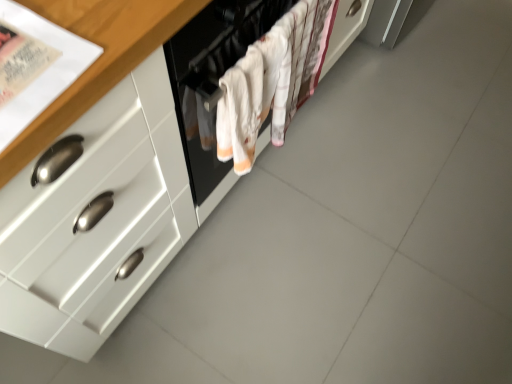
What do you see at coordinates (100, 221) in the screenshot? The height and width of the screenshot is (384, 512). I see `white glossy cabinet at center` at bounding box center [100, 221].

Looking at this image, what is the approximate height of white glossy cabinet at center?

white glossy cabinet at center is 34.22 inches in height.

What is the approximate width of white glossy cabinet at center?

The width of white glossy cabinet at center is 23.91 inches.

Locate an element on the screen. white glossy cabinet at center is located at coordinates (100, 221).

What do you see at coordinates (212, 82) in the screenshot?
I see `white fabric oven at center` at bounding box center [212, 82].

The image size is (512, 384). In order to click on white fabric oven at center in this screenshot , I will do `click(212, 82)`.

Measure the distance between point (224,43) and camera.

Point (224,43) and camera are 31.89 inches apart.

In order to face white fabric oven at center, should I rotate leftwards or rightwards?

Turn right approximately 4.288 degrees to face it.

Where is `white glossy cabinet at center`? This screenshot has width=512, height=384. white glossy cabinet at center is located at coordinates (100, 221).

In the scene shown: Is white fabric oven at center to the right of white glossy cabinet at center from the viewer's perspective?

Correct, you'll find white fabric oven at center to the right of white glossy cabinet at center.

Which object is further away from the camera taking this photo, white fabric oven at center or white glossy cabinet at center?

white fabric oven at center is behind.

Is point (224, 39) closer to viewer compared to point (198, 208)?

Yes, it is.

From the image's perspective, is white fabric oven at center above or below white glossy cabinet at center?

white fabric oven at center is situated lower than white glossy cabinet at center in the image.

From a real-world perspective, which is physically above, white fabric oven at center or white glossy cabinet at center?

In real-world perspective, white fabric oven at center is above.

Can you confirm if white fabric oven at center is thinner than white glossy cabinet at center?

Yes.

Does white fabric oven at center have a lesser height compared to white glossy cabinet at center?

Yes.

Based on their sizes in the image, would you say white fabric oven at center is bigger or smaller than white glossy cabinet at center?

white fabric oven at center is smaller than white glossy cabinet at center.

Choose the correct answer: Is white fabric oven at center inside white glossy cabinet at center or outside it?

white fabric oven at center is outside white glossy cabinet at center.

Are white fabric oven at center and white glossy cabinet at center making contact?

No, white fabric oven at center is not in contact with white glossy cabinet at center.

Is white fabric oven at center aimed at white glossy cabinet at center?

Yes, white fabric oven at center is aimed at white glossy cabinet at center.

Can you tell me how much white fabric oven at center and white glossy cabinet at center differ in facing direction?

The angle between the facing direction of white fabric oven at center and the facing direction of white glossy cabinet at center is 0.164 degrees.

Image resolution: width=512 pixels, height=384 pixels. Find the location of `cabinetry that appears below the white fabric oven at center (from a real-world perspective)`. cabinetry that appears below the white fabric oven at center (from a real-world perspective) is located at coordinates (100, 221).

Is white glossy cabinet at center at the left side of white fabric oven at center?

Yes, white glossy cabinet at center is to the left of white fabric oven at center.

Is white glossy cabinet at center in front of or behind white fabric oven at center in the image?

white glossy cabinet at center is positioned closer to the viewer than white fabric oven at center.

Which is in front, point (162, 108) or point (257, 19)?

The point (162, 108) is closer to the camera.

From the image's perspective, between white glossy cabinet at center and white fabric oven at center, which one is located above?

From the image's view, white glossy cabinet at center is above.

Consider the image. From a real-world perspective, is white glossy cabinet at center on white fabric oven at center?

No, from a real-world perspective, white glossy cabinet at center is not above white fabric oven at center.

Can you confirm if white glossy cabinet at center is wider than white fabric oven at center?

Yes, white glossy cabinet at center is wider than white fabric oven at center.

Considering the sizes of objects white glossy cabinet at center and white fabric oven at center in the image provided, who is taller, white glossy cabinet at center or white fabric oven at center?

With more height is white glossy cabinet at center.

Looking at this image, who is smaller, white glossy cabinet at center or white fabric oven at center?

Smaller between the two is white fabric oven at center.

Can we say white glossy cabinet at center lies outside white fabric oven at center?

Indeed, white glossy cabinet at center is completely outside white fabric oven at center.

Is white glossy cabinet at center directly adjacent to white fabric oven at center?

white glossy cabinet at center is not next to white fabric oven at center, and they're not touching.

Is white glossy cabinet at center facing towards white fabric oven at center?

Yes, white glossy cabinet at center is facing white fabric oven at center.

How many degrees apart are the facing directions of white glossy cabinet at center and white fabric oven at center?

The angle between the facing direction of white glossy cabinet at center and the facing direction of white fabric oven at center is 0.164 degrees.

Based on the photo, how far apart are white glossy cabinet at center and white fabric oven at center?

white glossy cabinet at center is 17.82 centimeters away from white fabric oven at center.

Where is `cabinetry that appears below the white fabric oven at center (from a real-world perspective)`? The height and width of the screenshot is (384, 512). cabinetry that appears below the white fabric oven at center (from a real-world perspective) is located at coordinates (100, 221).

There is a white glossy cabinet at center. At what (x,y) coordinates should I click in order to perform the action: click on oven above it (from a real-world perspective). Please return your answer as a coordinate pair (x, y). This screenshot has width=512, height=384. Looking at the image, I should click on (212, 82).

What are the coordinates of `cabinetry in front of the white fabric oven at center` in the screenshot? It's located at (100, 221).